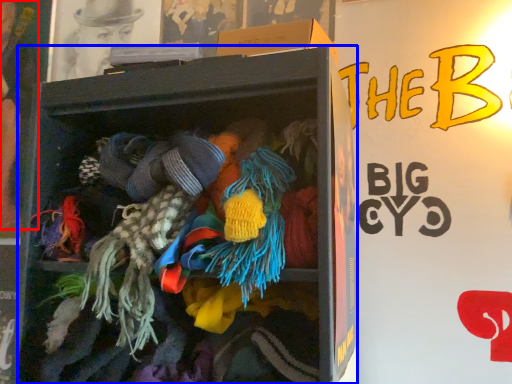
Question: Which object appears farthest to the camera in this image, person (highlighted by a red box) or shelf (highlighted by a blue box)?

Choices:
 (A) person
 (B) shelf

Answer: (A)